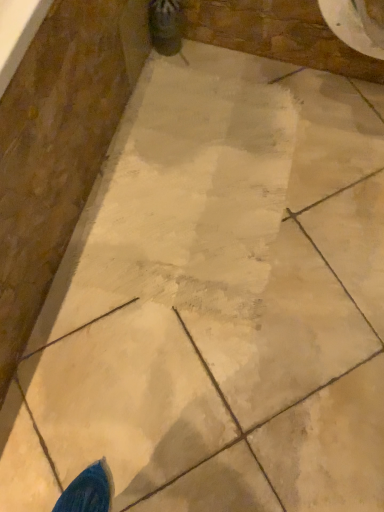
What are the coordinates of `dark brown leather shoe at upper center` in the screenshot? It's located at (165, 26).

Measure the distance between point (160, 47) and camera.

Point (160, 47) is 4.37 feet from camera.

The height and width of the screenshot is (512, 384). What do you see at coordinates (165, 26) in the screenshot? I see `dark brown leather shoe at upper center` at bounding box center [165, 26].

Image resolution: width=384 pixels, height=512 pixels. In order to click on dark brown leather shoe at upper center in this screenshot , I will do `click(165, 26)`.